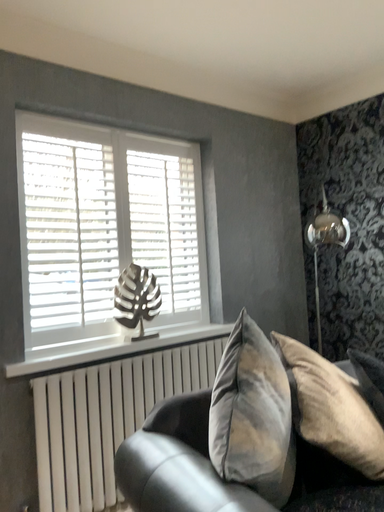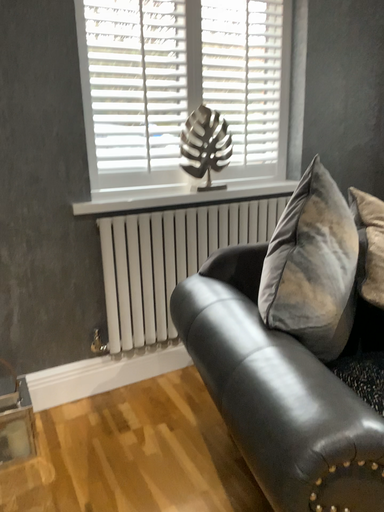
Question: How did the camera likely rotate when shooting the video?

Choices:
 (A) rotated downward
 (B) rotated upward

Answer: (A)